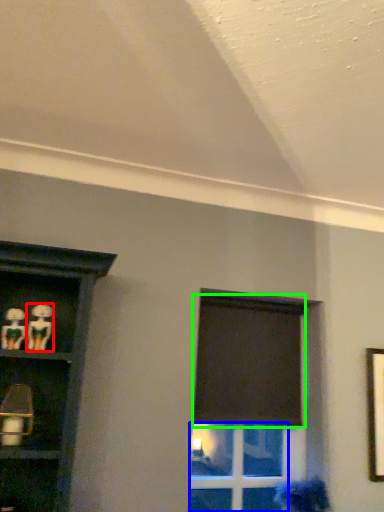
Question: Which object is positioned farthest from woman (highlighted by a red box)? Select from glass door (highlighted by a blue box) and curtain (highlighted by a green box).

Choices:
 (A) glass door
 (B) curtain

Answer: (A)